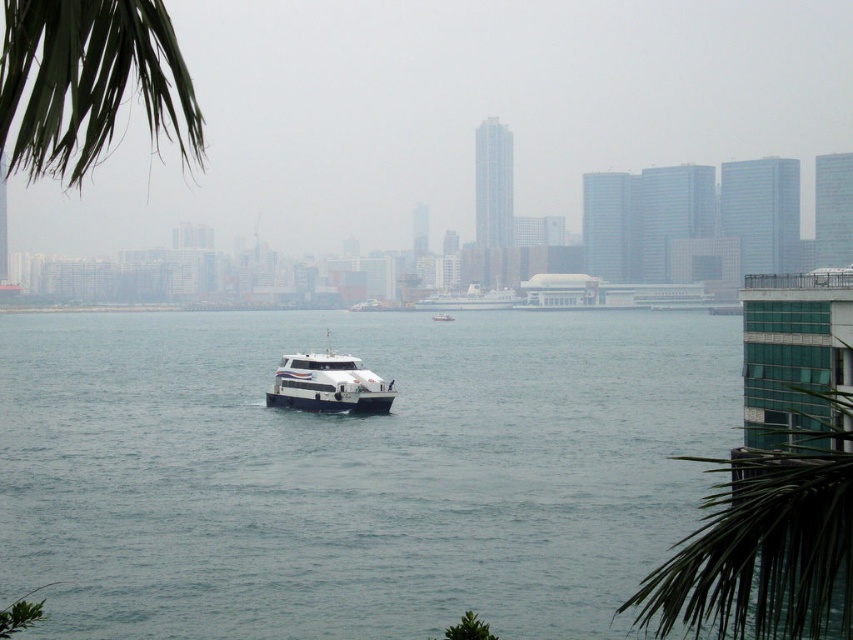
Question: Considering the real-world distances, which object is farthest from the white glossy ferry at center?

Choices:
 (A) white glossy boat at center
 (B) clear water at center
 (C) green leafy palm tree at upper left

Answer: (A)

Question: In this image, where is green leafy palm tree at lower right located relative to green leafy palm tree at upper left?

Choices:
 (A) above
 (B) below

Answer: (B)

Question: Which object appears closest to the camera in this image?

Choices:
 (A) white glossy ferry at center
 (B) green leafy palm tree at lower right
 (C) green leafy palm tree at upper left

Answer: (C)

Question: Which of the following is the farthest from the observer?

Choices:
 (A) clear water at center
 (B) white glossy boat at center
 (C) green leafy palm tree at upper left

Answer: (B)

Question: Observing the image, what is the correct spatial positioning of green leafy palm tree at lower right in reference to white glossy ferry at center?

Choices:
 (A) left
 (B) right

Answer: (A)

Question: Observing the image, what is the correct spatial positioning of clear water at center in reference to white glossy boat at center?

Choices:
 (A) above
 (B) below

Answer: (A)